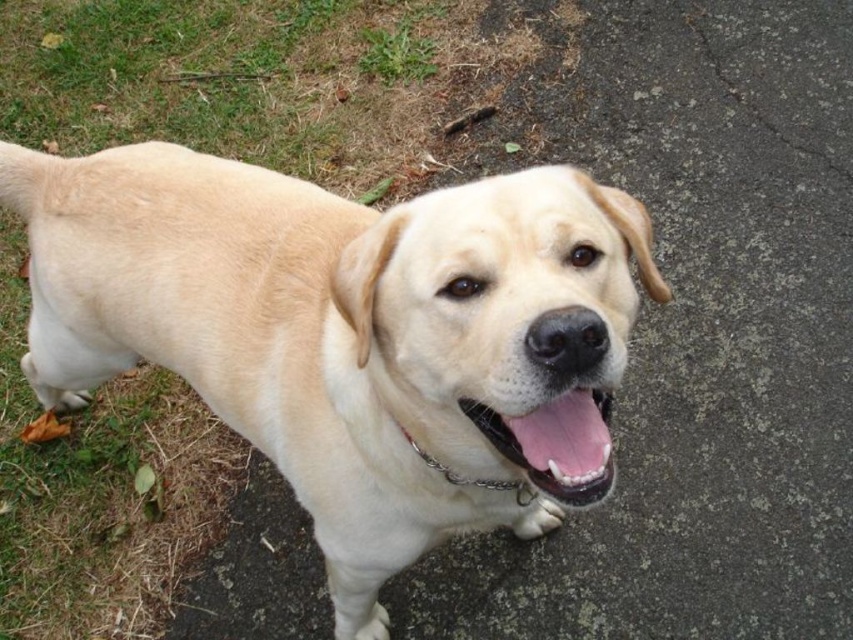
Question: Does light beige fur dog at center have a smaller size compared to pink glossy tongue at center?

Choices:
 (A) yes
 (B) no

Answer: (B)

Question: Can you confirm if pink glossy tongue at center is wider than metal chain at center?

Choices:
 (A) yes
 (B) no

Answer: (B)

Question: Which point is closer to the camera?

Choices:
 (A) (521, 458)
 (B) (436, 461)

Answer: (A)

Question: Based on their relative distances, which object is nearer to the metal chain at center?

Choices:
 (A) pink glossy tongue at center
 (B) light beige fur dog at center

Answer: (A)

Question: Is light beige fur dog at center to the right of pink glossy tongue at center from the viewer's perspective?

Choices:
 (A) no
 (B) yes

Answer: (A)

Question: Which point appears closest to the camera in this image?

Choices:
 (A) (492, 520)
 (B) (421, 449)

Answer: (B)